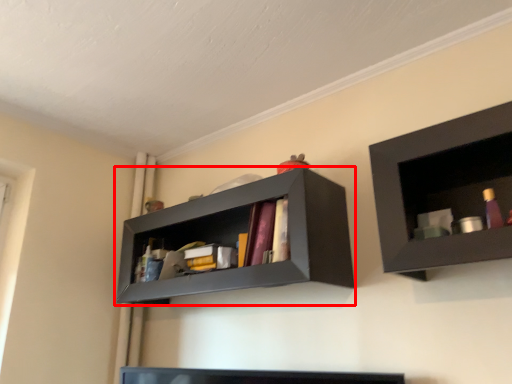
Question: From the image's perspective, considering the relative positions of shelf (annotated by the red box) and shelf in the image provided, where is shelf (annotated by the red box) located with respect to the staircase?

Choices:
 (A) below
 (B) above

Answer: (A)